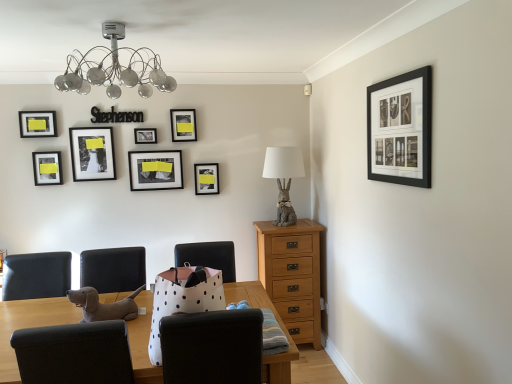
Question: From the image's perspective, does matte black picture frame at upper center, arranged as the sixth picture frame when viewed from the front, appear lower than white polka dot paper bag at center, positioned as the 2th chair in left-to-right order?

Choices:
 (A) no
 (B) yes

Answer: (A)

Question: Considering the relative positions of matte black picture frame at upper center, arranged as the sixth picture frame when viewed from the front, and white polka dot paper bag at center, placed as the 1th chair when sorted from right to left, in the image provided, is matte black picture frame at upper center, arranged as the sixth picture frame when viewed from the front, to the left of white polka dot paper bag at center, placed as the 1th chair when sorted from right to left, from the viewer's perspective?

Choices:
 (A) yes
 (B) no

Answer: (A)

Question: Can you confirm if matte black picture frame at upper center, which appears as the 4th picture frame when viewed from the right, is smaller than white polka dot paper bag at center, positioned as the 2th chair in left-to-right order?

Choices:
 (A) no
 (B) yes

Answer: (B)

Question: Is matte black picture frame at upper center, arranged as the sixth picture frame when viewed from the front, bigger than white polka dot paper bag at center, positioned as the 2th chair in left-to-right order?

Choices:
 (A) no
 (B) yes

Answer: (A)

Question: Are matte black picture frame at upper center, the fifth picture frame from the left, and white polka dot paper bag at center, positioned as the 2th chair in left-to-right order, beside each other?

Choices:
 (A) no
 (B) yes

Answer: (A)

Question: In terms of height, does matte black picture frame at left, the seventh picture frame when ordered from right to left, look taller or shorter compared to matte black picture frame at upper center, the fifth picture frame from the left?

Choices:
 (A) tall
 (B) short

Answer: (B)

Question: From the image's perspective, is matte black picture frame at left, the seventh picture frame when ordered from right to left, located above or below matte black picture frame at upper center, the fifth picture frame from the left?

Choices:
 (A) above
 (B) below

Answer: (A)

Question: In the image, is matte black picture frame at left, marked as the second picture frame in a left-to-right arrangement, positioned in front of or behind matte black picture frame at upper center, which appears as the 4th picture frame when viewed from the right?

Choices:
 (A) behind
 (B) front

Answer: (B)

Question: From a real-world perspective, is matte black picture frame at left, the 6th picture frame when ordered from back to front, above or below matte black picture frame at upper center, which is the third picture frame in back-to-front order?

Choices:
 (A) below
 (B) above

Answer: (B)

Question: Considering the positions of matte black picture frame at left, the seventh picture frame when ordered from right to left, and matte black photo frame at upper left, which is the 4th picture frame in front-to-back order, in the image, is matte black picture frame at left, the seventh picture frame when ordered from right to left, wider or thinner than matte black photo frame at upper left, which is the 4th picture frame in front-to-back order,?

Choices:
 (A) thin
 (B) wide

Answer: (A)

Question: From the image's perspective, is matte black picture frame at left, marked as the second picture frame in a left-to-right arrangement, located above or below matte black photo frame at upper left, positioned as the 5th picture frame in back-to-front order?

Choices:
 (A) below
 (B) above

Answer: (A)

Question: From a real-world perspective, is matte black picture frame at left, marked as the second picture frame in a left-to-right arrangement, positioned above or below matte black photo frame at upper left, positioned as the 5th picture frame in back-to-front order?

Choices:
 (A) below
 (B) above

Answer: (A)

Question: Is point (57, 183) positioned closer to the camera than point (93, 167)?

Choices:
 (A) farther
 (B) closer

Answer: (B)

Question: Considering the positions of black matte picture frame at upper center, the 5th picture frame when ordered from front to back, and black matte picture frame at upper right, which is counted as the 8th picture frame, starting from the left, in the image, is black matte picture frame at upper center, the 5th picture frame when ordered from front to back, taller or shorter than black matte picture frame at upper right, which is counted as the 8th picture frame, starting from the left,?

Choices:
 (A) tall
 (B) short

Answer: (B)

Question: Does point (142, 127) appear closer or farther from the camera than point (425, 82)?

Choices:
 (A) closer
 (B) farther

Answer: (B)